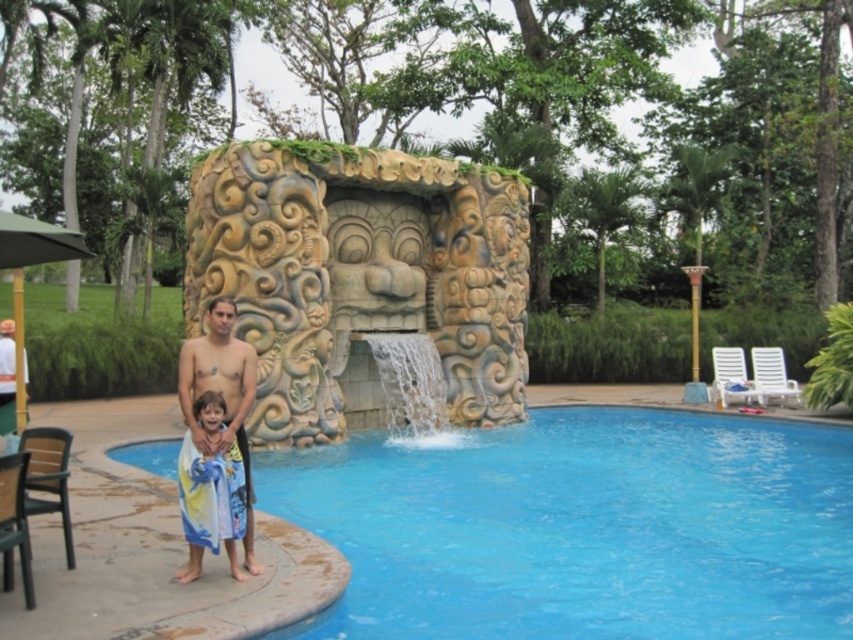
Does blue glossy swimming pool at lower center have a smaller size compared to smooth tan skin at left?

Actually, blue glossy swimming pool at lower center might be larger than smooth tan skin at left.

Based on the photo, who is taller, blue glossy swimming pool at lower center or smooth tan skin at left?

smooth tan skin at left is taller.

Between point (126, 460) and point (13, 424), which one is positioned in front?

Positioned in front is point (13, 424).

Image resolution: width=853 pixels, height=640 pixels. In order to click on blue glossy swimming pool at lower center in this screenshot , I will do `click(581, 528)`.

Can you confirm if smooth tan towel at center is wider than smooth tan skin at left?

No, smooth tan towel at center is not wider than smooth tan skin at left.

Who is lower down, smooth tan towel at center or smooth tan skin at left?

smooth tan skin at left is below.

Is point (190, 419) farther from viewer compared to point (4, 429)?

No, it is in front of (4, 429).

Locate an element on the screen. smooth tan towel at center is located at coordinates (218, 372).

Can you confirm if blue glossy swimming pool at lower center is positioned above smooth tan towel at center?

Incorrect, blue glossy swimming pool at lower center is not positioned above smooth tan towel at center.

Between point (724, 605) and point (233, 321), which one is positioned behind?

Point (233, 321)

Where is `blue glossy swimming pool at lower center`? The height and width of the screenshot is (640, 853). blue glossy swimming pool at lower center is located at coordinates (581, 528).